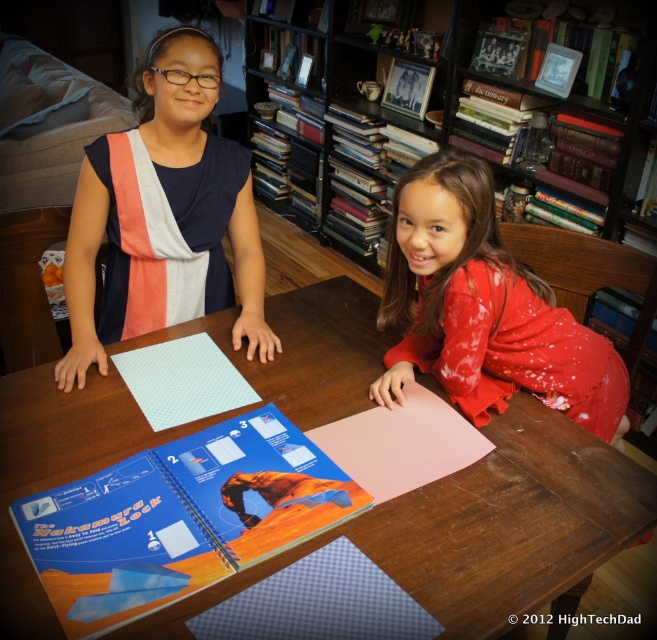
Question: Which point is closer to the camera?

Choices:
 (A) (564, 536)
 (B) (340, 90)

Answer: (A)

Question: Which is nearer to the matte red dress at lower right?

Choices:
 (A) wooden table at center
 (B) wooden bookshelf at upper center

Answer: (A)

Question: Which object is the closest to the blue glossy book at center?

Choices:
 (A) wooden bookshelf at upper center
 (B) blue fabric dress at left
 (C) wooden table at center

Answer: (C)

Question: Does blue fabric dress at left appear under wooden bookshelf at upper center?

Choices:
 (A) yes
 (B) no

Answer: (A)

Question: Does wooden table at center have a larger size compared to blue fabric dress at left?

Choices:
 (A) yes
 (B) no

Answer: (A)

Question: Observing the image, what is the correct spatial positioning of wooden table at center in reference to blue glossy book at center?

Choices:
 (A) above
 (B) below

Answer: (A)